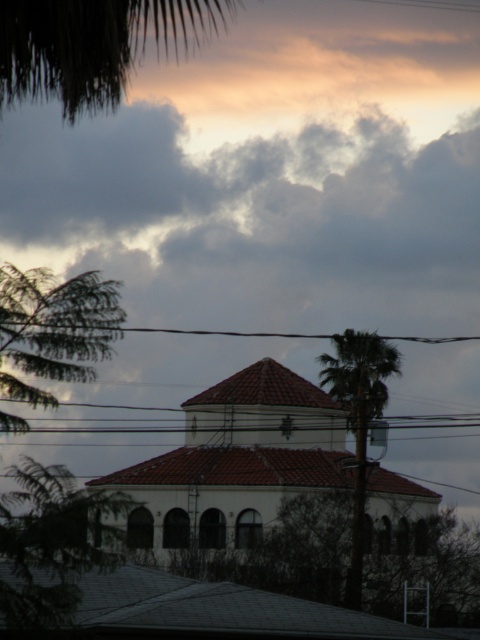
Question: Which point appears closest to the camera in this image?

Choices:
 (A) (35, 358)
 (B) (320, 378)
 (C) (222, 333)
 (D) (7, 611)

Answer: (D)

Question: Does green leafy tree at left have a lesser width compared to green leafy palm at center?

Choices:
 (A) no
 (B) yes

Answer: (B)

Question: Considering the real-world distances, which object is closest to the green leafy tree at left?

Choices:
 (A) black wire at upper center
 (B) dark green leafy tree at upper left
 (C) green leafy palm at center
 (D) green leafy tree at lower left

Answer: (D)

Question: Can you confirm if green leafy tree at lower left is wider than green leafy palm at center?

Choices:
 (A) yes
 (B) no

Answer: (A)

Question: Which object is closer to the camera taking this photo?

Choices:
 (A) green leafy tree at lower left
 (B) green leafy tree at left
 (C) dark green leafy tree at upper left
 (D) black wire at upper center

Answer: (C)

Question: Can you confirm if dark green leafy tree at upper left is bigger than green leafy palm at center?

Choices:
 (A) no
 (B) yes

Answer: (B)